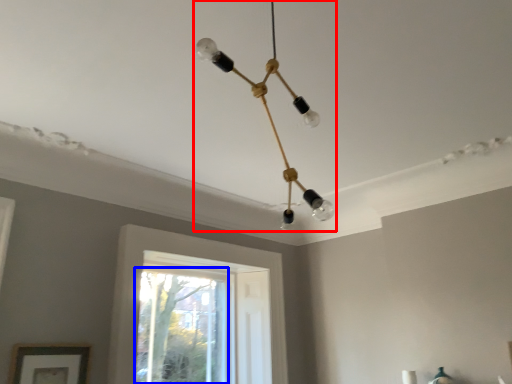
Question: Which object appears closest to the camera in this image, lamp (highlighted by a red box) or window (highlighted by a blue box)?

Choices:
 (A) lamp
 (B) window

Answer: (A)